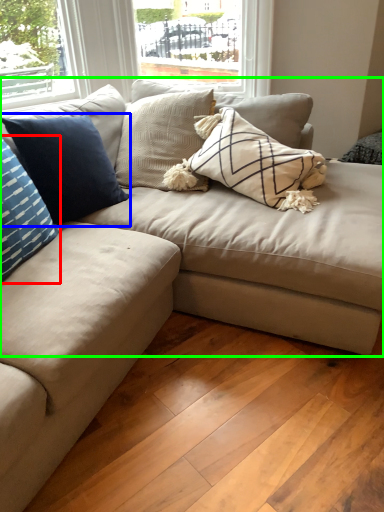
Question: Which object is the closest to the pillow (highlighted by a red box)? Choose among these: pillow (highlighted by a blue box) or studio couch (highlighted by a green box).

Choices:
 (A) pillow
 (B) studio couch

Answer: (A)